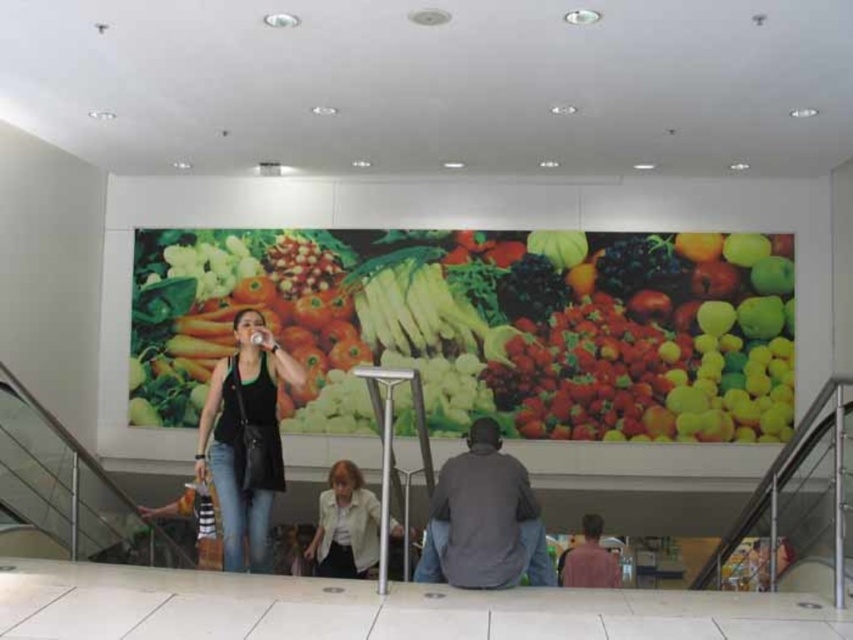
Question: Which object is positioned closest to the matte pink shirt at lower right?

Choices:
 (A) black matte tank top at center
 (B) vibrant plastic vegetables at center

Answer: (B)

Question: Is vibrant plastic vegetables at center thinner than black matte tank top at center?

Choices:
 (A) no
 (B) yes

Answer: (A)

Question: Which of these objects is positioned closest to the black matte tank top at center?

Choices:
 (A) dark gray sweater at center
 (B) matte pink shirt at lower right

Answer: (A)

Question: Which point is farther to the camera?

Choices:
 (A) (x=451, y=467)
 (B) (x=567, y=336)
 (C) (x=334, y=490)

Answer: (B)

Question: Is vibrant plastic vegetables at center below dark gray sweater at center?

Choices:
 (A) no
 (B) yes

Answer: (A)

Question: Does black matte tank top at center have a smaller size compared to matte pink shirt at lower right?

Choices:
 (A) yes
 (B) no

Answer: (B)